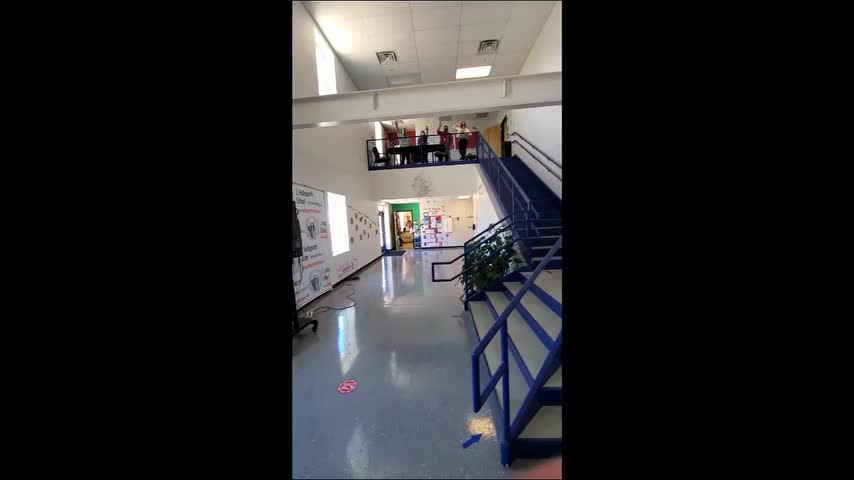
This screenshot has height=480, width=854. What are the coordinates of `ceiling` in the screenshot? It's located at (430, 32).